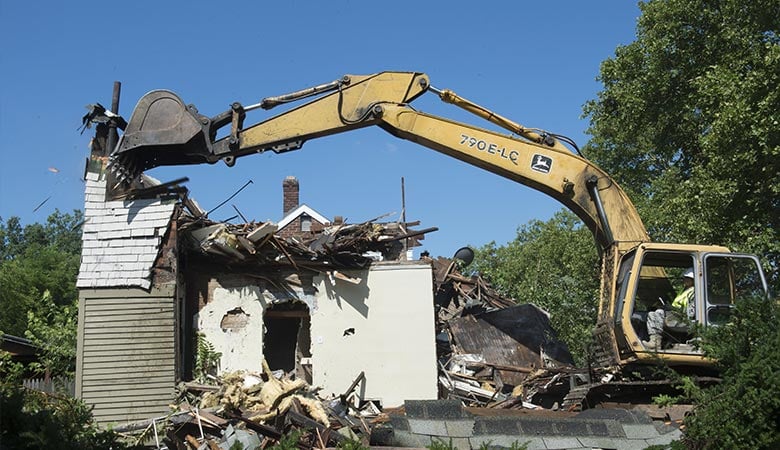
Locate an element on the screen. The width and height of the screenshot is (780, 450). doorway opening is located at coordinates (291, 345).